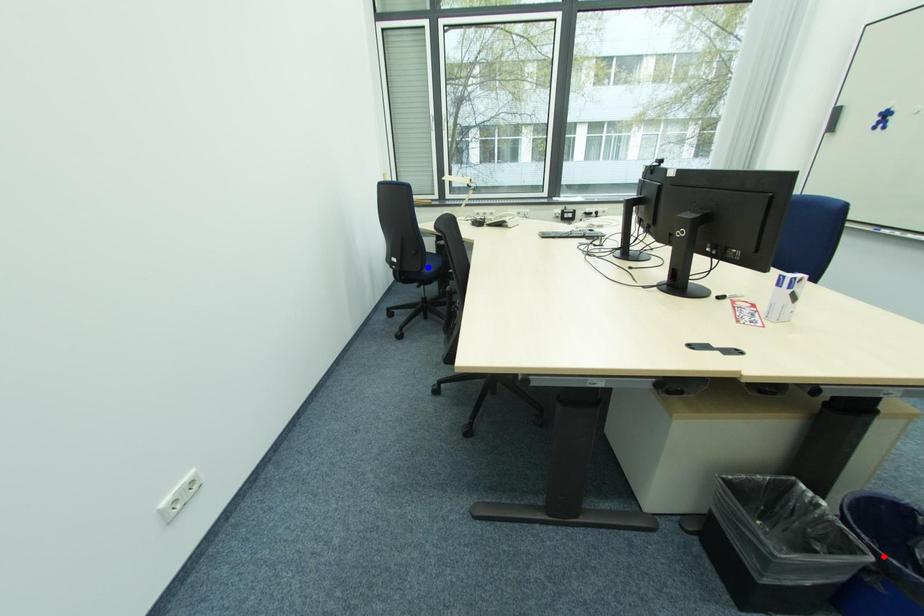
Question: Which of the two points in the image is closer to the camera?

Choices:
 (A) Blue point is closer.
 (B) Red point is closer.

Answer: (B)